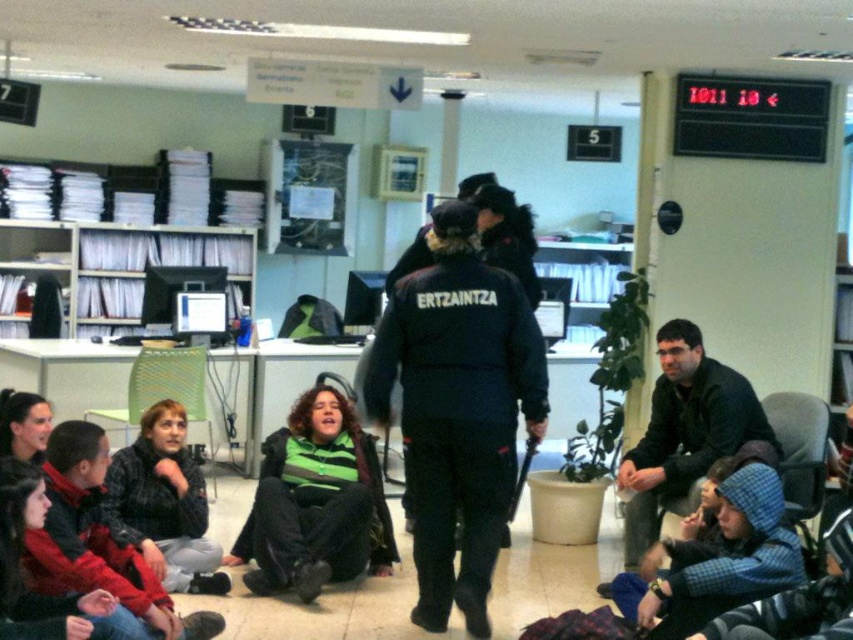
Question: Which of the following is the farthest from the observer?

Choices:
 (A) dark gray jacket at lower left
 (B) dark blue jacket at center
 (C) black uniform at center

Answer: (B)

Question: Does green striped sweater at center appear on the left side of dark gray jacket at lower left?

Choices:
 (A) yes
 (B) no

Answer: (B)

Question: Estimate the real-world distances between objects in this image. Which object is farther from the dark blue jacket at center?

Choices:
 (A) black uniform at center
 (B) dark gray jacket at lower left

Answer: (B)

Question: Which object is closer to the camera taking this photo?

Choices:
 (A) green striped sweater at center
 (B) black uniform at center
 (C) dark gray jacket at lower left

Answer: (C)

Question: Can you confirm if black uniform at center is positioned to the right of dark blue jacket at center?

Choices:
 (A) yes
 (B) no

Answer: (B)

Question: Does dark gray jacket at lower left have a greater width compared to dark blue jacket at center?

Choices:
 (A) no
 (B) yes

Answer: (B)